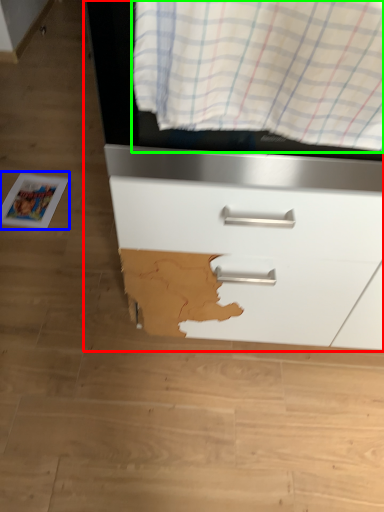
Question: Which object is the closest to the chest of drawers (highlighted by a red box)? Choose among these: magazine (highlighted by a blue box) or curtain (highlighted by a green box).

Choices:
 (A) magazine
 (B) curtain

Answer: (B)